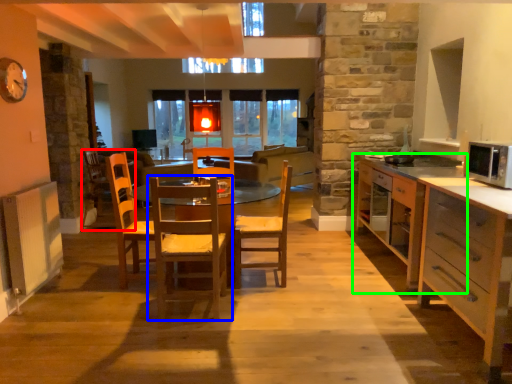
Question: Which object is the farthest from armchair (highlighted by a red box)? Choose among these: chair (highlighted by a blue box) or cabinetry (highlighted by a green box).

Choices:
 (A) chair
 (B) cabinetry

Answer: (B)